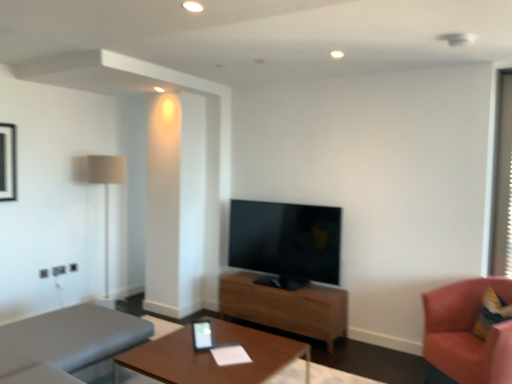
Question: Is point (310, 317) positioned closer to the camera than point (443, 354)?

Choices:
 (A) farther
 (B) closer

Answer: (A)

Question: Considering the positions of wooden table at center, which appears as the 1th table when viewed from the back, and pink fabric chair at right in the image, is wooden table at center, which appears as the 1th table when viewed from the back, wider or thinner than pink fabric chair at right?

Choices:
 (A) wide
 (B) thin

Answer: (B)

Question: Which is farther from the wooden table at center, the first table viewed from the front?

Choices:
 (A) beige fabric lamp at left
 (B) gray fabric studio couch at lower left
 (C) pink fabric chair at right
 (D) black glossy picture frame at upper left
 (E) matte black tv at center

Answer: (D)

Question: Which object is positioned farthest from the beige fabric lamp at left?

Choices:
 (A) transparent plastic window screen at right
 (B) matte black tv at center
 (C) pink fabric chair at right
 (D) wooden table at center, acting as the second table starting from the back
 (E) black glossy picture frame at upper left

Answer: (A)